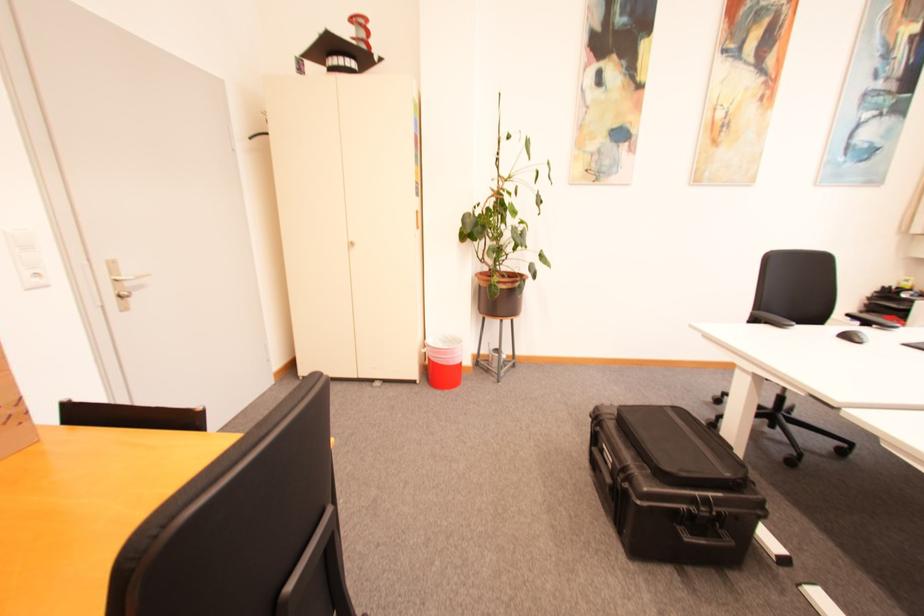
The image size is (924, 616). What do you see at coordinates (500, 294) in the screenshot?
I see `the brown flower pot` at bounding box center [500, 294].